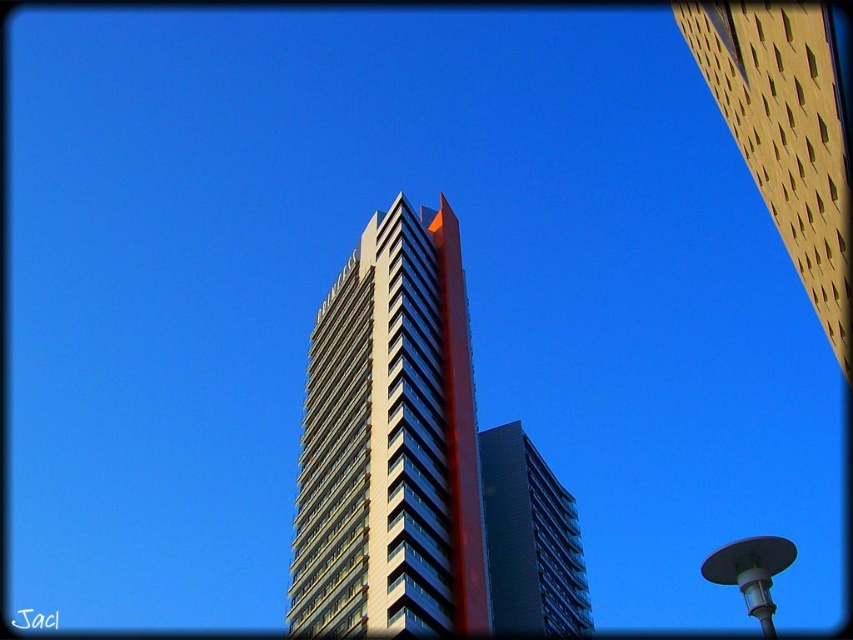
Is sleek glass tower at center below dark gray glass building at center?

Incorrect, sleek glass tower at center is not positioned below dark gray glass building at center.

Who is taller, sleek glass tower at center or dark gray glass building at center?

With more height is sleek glass tower at center.

Does point (322, 544) lie in front of point (535, 605)?

Yes, it is in front of point (535, 605).

Find the location of a particular element. sleek glass tower at center is located at coordinates (390, 442).

Which is in front, point (386, 417) or point (843, 227)?

Point (843, 227) is in front.

Between sleek glass tower at center and gold textured building at upper right, which one has more height?

With more height is sleek glass tower at center.

Is point (370, 477) positioned after point (795, 51)?

That is True.

The image size is (853, 640). Find the location of `sleek glass tower at center`. sleek glass tower at center is located at coordinates (390, 442).

Does point (779, 86) lie behind point (506, 467)?

No, it is not.

Is point (796, 244) less distant than point (535, 516)?

Yes.

Find the location of a particular element. gold textured building at upper right is located at coordinates [785, 134].